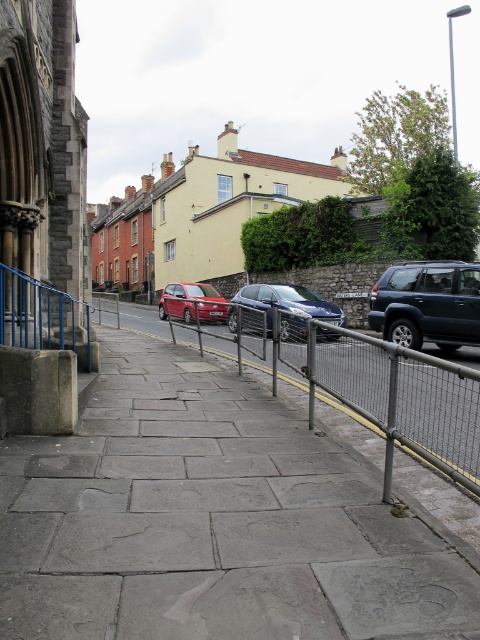
Which is below, gray stone pavement at center or matte red car at center?

gray stone pavement at center is lower down.

Who is more distant from viewer, (171,452) or (219,300)?

The point (219,300) is behind.

The image size is (480, 640). What do you see at coordinates (213, 520) in the screenshot?
I see `gray stone pavement at center` at bounding box center [213, 520].

This screenshot has height=640, width=480. Find the location of `gray stone pavement at center`. gray stone pavement at center is located at coordinates (213, 520).

Is point (476, 280) positioned before point (192, 298)?

Yes, it is in front of point (192, 298).

Image resolution: width=480 pixels, height=640 pixels. Describe the element at coordinates (428, 304) in the screenshot. I see `satin blue suv at right` at that location.

Identify the location of satin blue suv at right. (428, 304).

Based on the photo, does gray stone pavement at center appear on the left side of shiny blue sedan at center?

Yes, gray stone pavement at center is to the left of shiny blue sedan at center.

Is gray stone pavement at center taller than shiny blue sedan at center?

In fact, gray stone pavement at center may be shorter than shiny blue sedan at center.

Is point (208, 368) positioned after point (264, 288)?

No, (208, 368) is in front of (264, 288).

Locate an element on the screen. This screenshot has width=480, height=640. gray stone pavement at center is located at coordinates (213, 520).